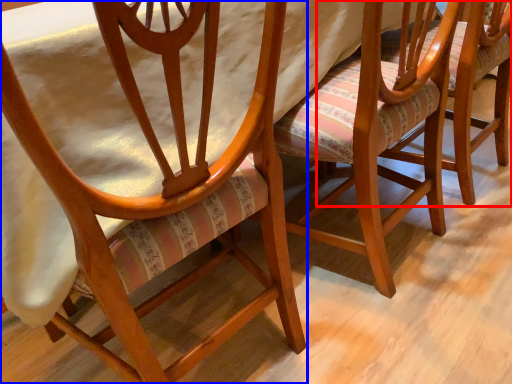
Question: Which of the following is the closest to the observer, chair (highlighted by a red box) or chair (highlighted by a blue box)?

Choices:
 (A) chair
 (B) chair

Answer: (B)